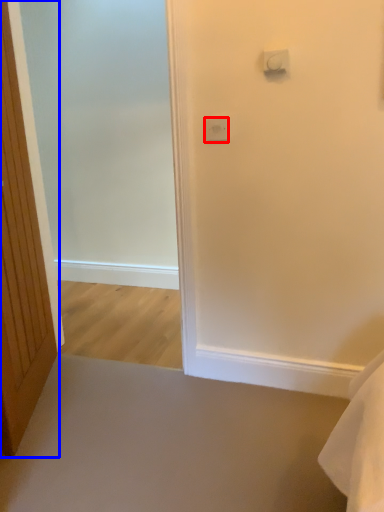
Question: Which of the following is the closest to the observer, light switch (highlighted by a red box) or door (highlighted by a blue box)?

Choices:
 (A) light switch
 (B) door

Answer: (B)